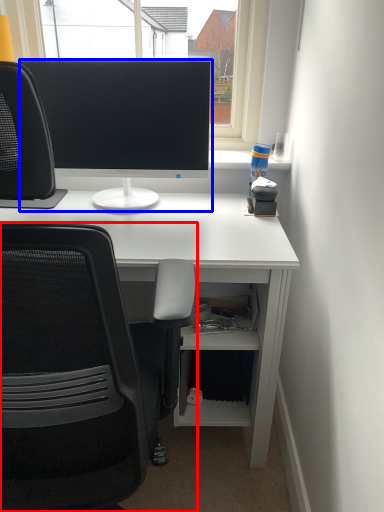
Question: Among these objects, which one is farthest to the camera, chair (highlighted by a red box) or computer monitor (highlighted by a blue box)?

Choices:
 (A) chair
 (B) computer monitor

Answer: (B)